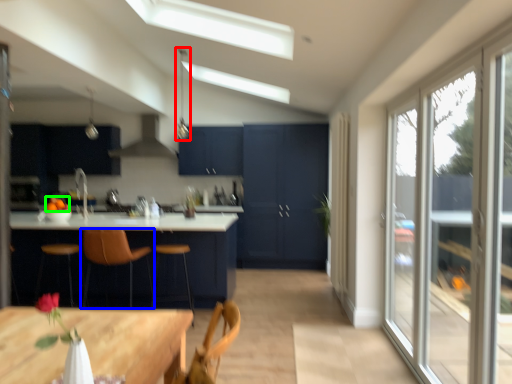
Question: Estimate the real-world distances between objects in this image. Which object is farther from light fixture (highlighted by a red box), chair (highlighted by a blue box) or fruit (highlighted by a green box)?

Choices:
 (A) chair
 (B) fruit

Answer: (A)